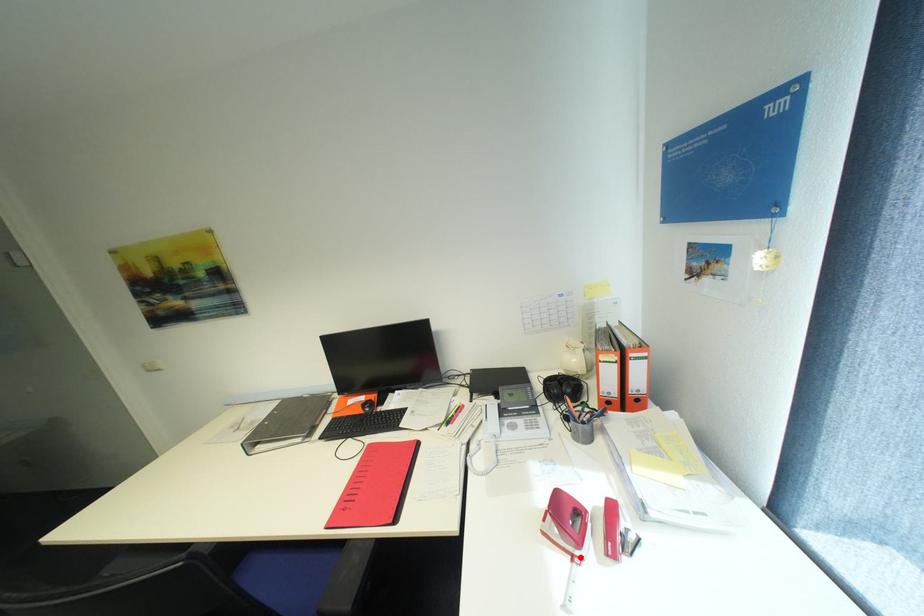
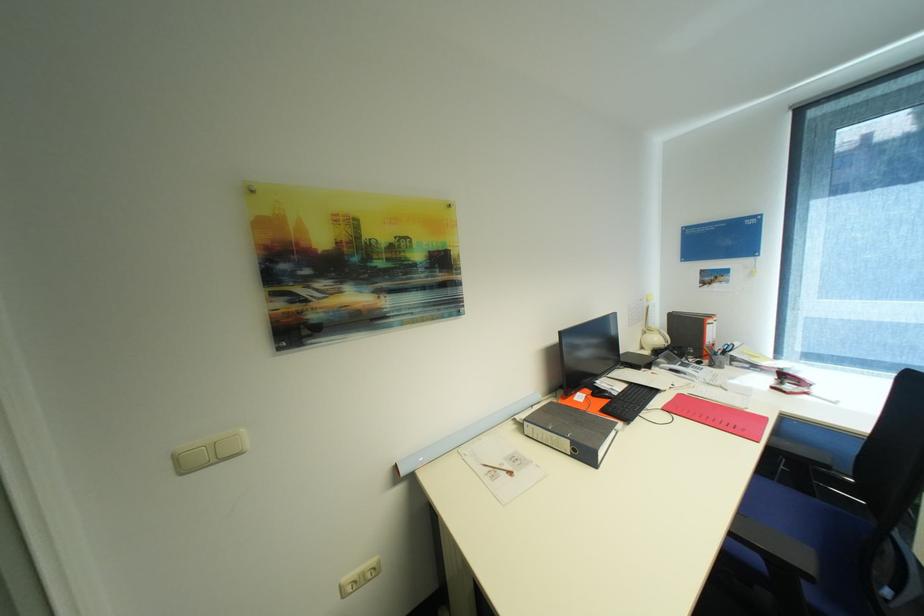
Where in the second image is the point corresponding to the highlighted location from the first image?

(813, 394)